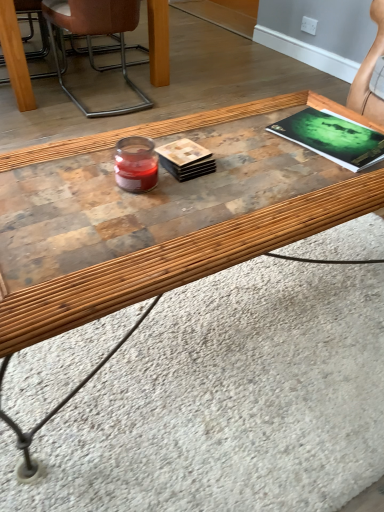
Find the location of a particular element. The width and height of the screenshot is (384, 512). vacant area that is in front of green matte magazine at upper right is located at coordinates click(321, 186).